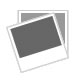
Where is `poloroid pictures`? poloroid pictures is located at coordinates (43, 59).